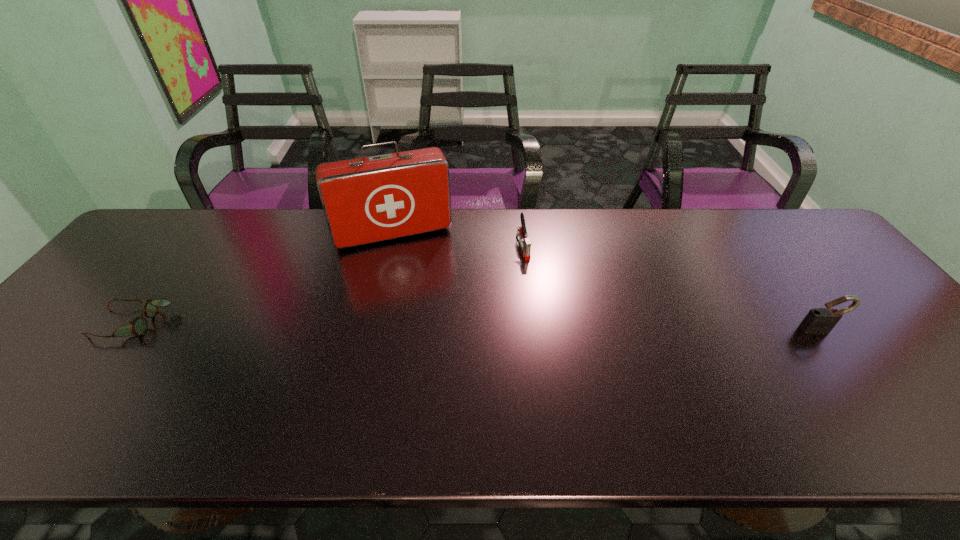
I want to click on free space on the desktop that is between the spectacles and the rightmost object and is positioned on the handle side of the third object from left to right, so click(x=553, y=327).

This screenshot has height=540, width=960. What are the coordinates of `vacant spot on the desktop that is between the shortest object and the third shortest object and is positioned on the side of the tallest object with the first aid cross symbol` in the screenshot? It's located at (421, 326).